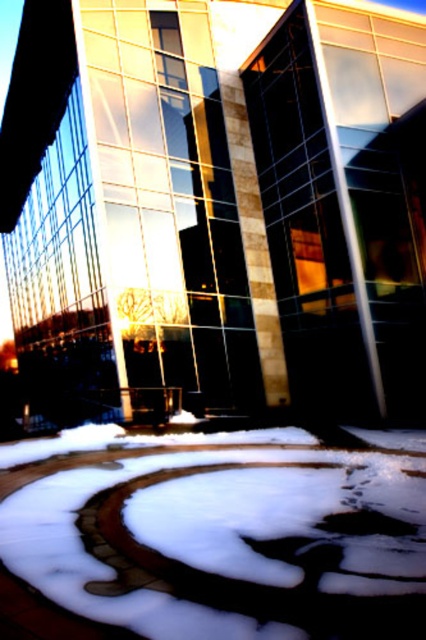
Measure the distance between white concrete pavement at lower center and brown textured footprint at center.

A distance of 15.98 inches exists between white concrete pavement at lower center and brown textured footprint at center.

Between point (226, 467) and point (363, 508), which one is positioned in front?

Point (363, 508) is in front.

At what (x,y) coordinates should I click in order to perform the action: click on white concrete pavement at lower center. Please return your answer as a coordinate pair (x, y). This screenshot has width=426, height=640. Looking at the image, I should click on tap(210, 536).